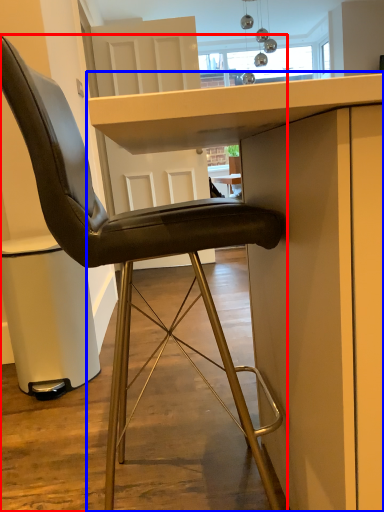
Question: Which point is further to the camera, chair (highlighted by a red box) or table (highlighted by a blue box)?

Choices:
 (A) chair
 (B) table

Answer: (A)